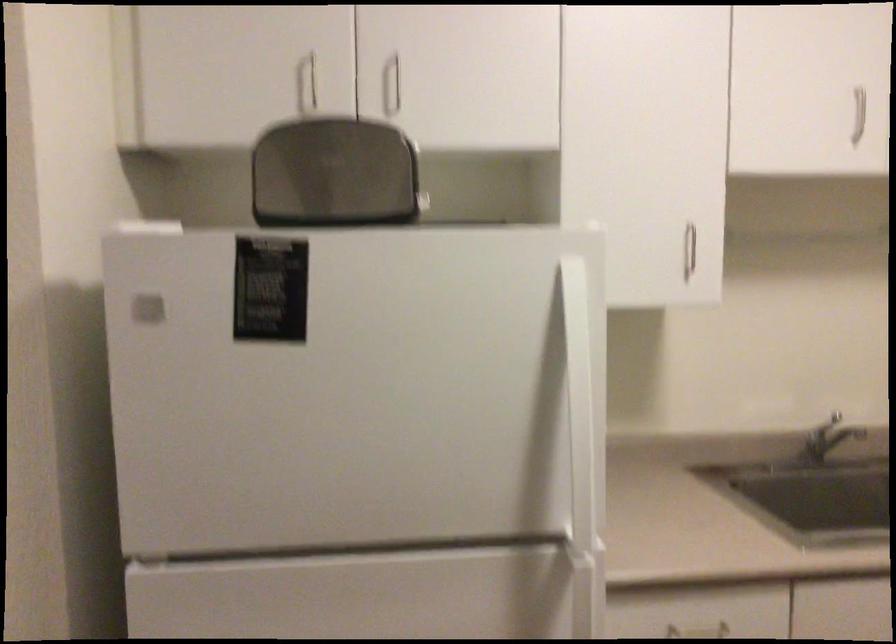
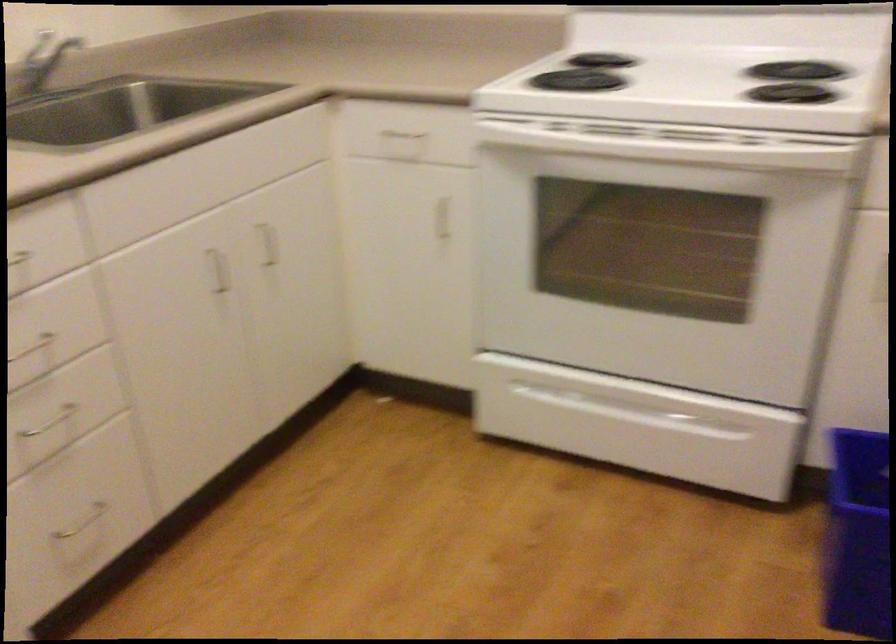
In the scene shown: The first image is from the beginning of the video and the second image is from the end. How did the camera likely rotate when shooting the video?

The camera rotated toward right-down.